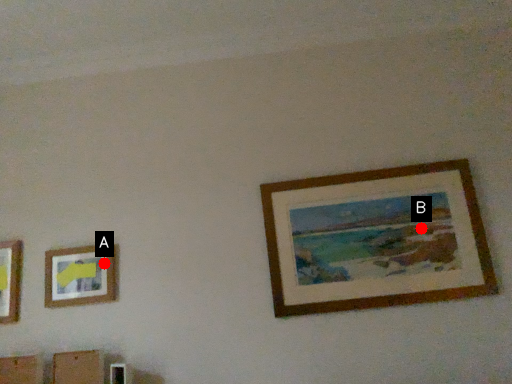
Question: Two points are circled on the image, labeled by A and B beside each circle. Which point is farther to the camera?

Choices:
 (A) A is further
 (B) B is further

Answer: (A)